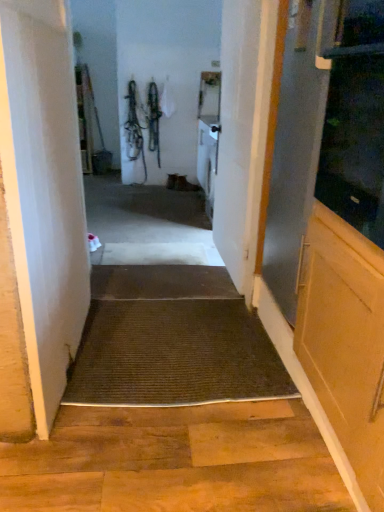
Question: From the image's perspective, is white wood door at center, acting as the second door starting from the left, located above or below brown textured mat at center, arranged as the first doormat when viewed from the front?

Choices:
 (A) above
 (B) below

Answer: (A)

Question: From a real-world perspective, relative to brown textured mat at center, which is the second doormat in back-to-front order, is white wood door at center, acting as the second door starting from the left, vertically above or below?

Choices:
 (A) above
 (B) below

Answer: (A)

Question: Which is nearer to the transparent glass screen door at right, the first screen door when ordered from front to back?

Choices:
 (A) brown textured mat at center, which is the second doormat in back-to-front order
 (B) white matte door at center, the first door positioned from the left
 (C) white wood door at center, acting as the second door starting from the left
 (D) transparent glass screen door at right, placed as the second screen door when sorted from front to back
 (E) brown textured mat at center, the 2th doormat positioned from the bottom

Answer: (D)

Question: Which is farther from the transparent glass screen door at right, arranged as the first screen door when viewed from the back?

Choices:
 (A) transparent glass screen door at right, the first screen door when ordered from front to back
 (B) white wood door at center, acting as the second door starting from the left
 (C) brown textured mat at center, placed as the 2th doormat when sorted from front to back
 (D) white matte door at center, which is counted as the 2th door, starting from the right
 (E) brown textured mat at center, arranged as the first doormat when viewed from the front

Answer: (C)